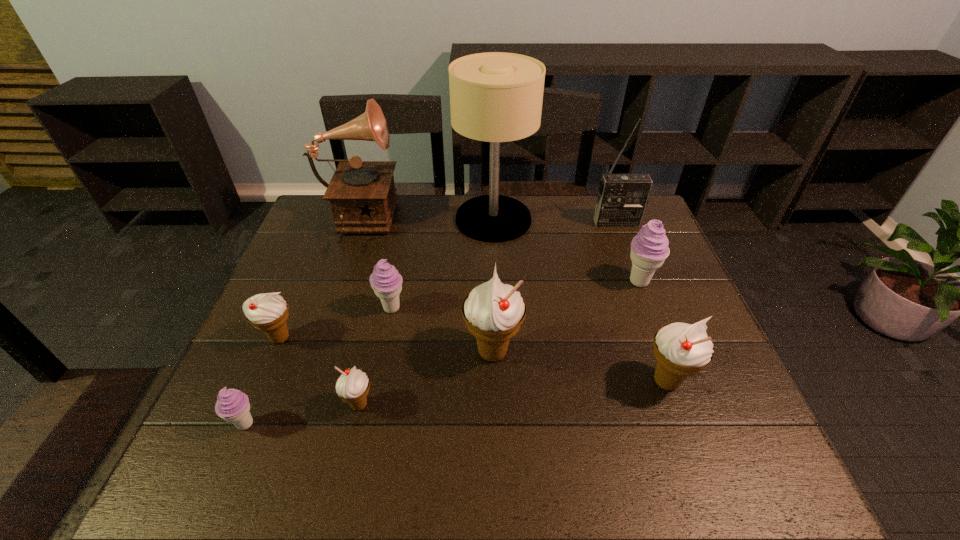
Where is `beige table lamp`? The image size is (960, 540). beige table lamp is located at coordinates tap(495, 97).

Find the location of a particular element. The width and height of the screenshot is (960, 540). the tallest object is located at coordinates (495, 97).

Identify the location of record player. [362, 194].

The width and height of the screenshot is (960, 540). Identify the location of radio receiver. (622, 199).

In order to click on the fourth tallest object in this screenshot , I will do `click(493, 312)`.

This screenshot has width=960, height=540. Identify the location of the second white icecream from right to left. (493, 312).

The height and width of the screenshot is (540, 960). I want to click on the seventh nearest object, so click(649, 248).

This screenshot has height=540, width=960. In order to click on the biggest purple icecream in this screenshot , I will do `click(649, 248)`.

Locate an element on the screen. The height and width of the screenshot is (540, 960). the third smallest white icecream is located at coordinates (680, 349).

Locate an element on the screen. The width and height of the screenshot is (960, 540). the leftmost white icecream is located at coordinates (268, 312).